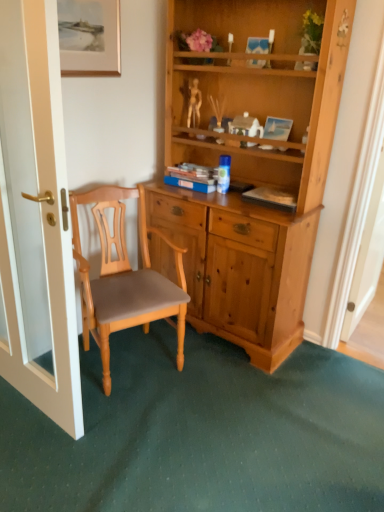
Identify the location of free point to the right of light brown wood chair at center. Image resolution: width=384 pixels, height=512 pixels. (241, 403).